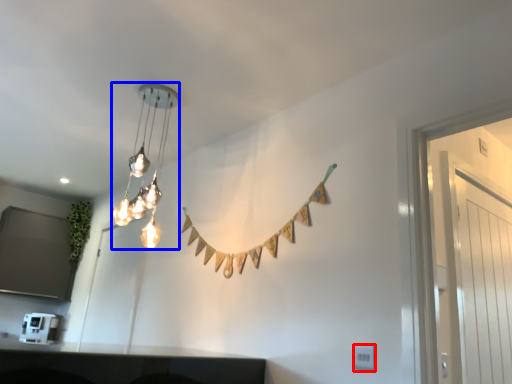
Question: Which object is further to the camera taking this photo, electric outlet (highlighted by a red box) or lamp (highlighted by a blue box)?

Choices:
 (A) electric outlet
 (B) lamp

Answer: (B)